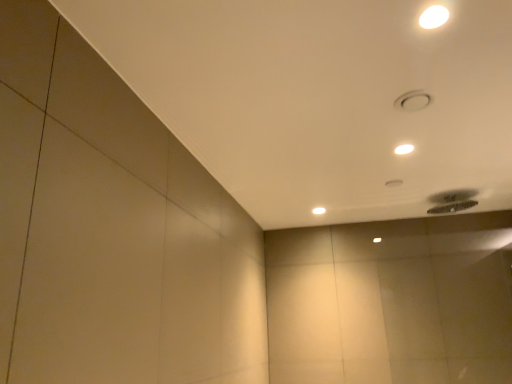
Describe the element at coordinates (404, 149) in the screenshot. I see `white glossy lamp at upper right, the 3th lamp positioned from the left` at that location.

What is the approximate height of white glossy lamp at upper right, the 1th lamp positioned from the front?

The height of white glossy lamp at upper right, the 1th lamp positioned from the front, is 0.39 inches.

The height and width of the screenshot is (384, 512). Describe the element at coordinates (433, 17) in the screenshot. I see `white glossy lamp at upper right, marked as the third lamp in a back-to-front arrangement` at that location.

The width and height of the screenshot is (512, 384). Describe the element at coordinates (319, 210) in the screenshot. I see `white glossy lamp at upper center, which appears as the third lamp when viewed from the top` at that location.

Identify the location of white glossy lamp at upper right, the 3th lamp positioned from the left. (404, 149).

Is white glossy lamp at upper center, the 1th lamp from the bottom, surrounding white glossy lamp at upper right, which is the second lamp in right-to-left order?

That's incorrect, white glossy lamp at upper right, which is the second lamp in right-to-left order, is not inside white glossy lamp at upper center, the 1th lamp from the bottom.

Considering the sizes of objects white glossy lamp at upper center, the 1th lamp from the bottom, and white glossy lamp at upper right, which appears as the 3th lamp when ordered from the bottom, in the image provided, who is smaller, white glossy lamp at upper center, the 1th lamp from the bottom, or white glossy lamp at upper right, which appears as the 3th lamp when ordered from the bottom,?

With smaller size is white glossy lamp at upper right, which appears as the 3th lamp when ordered from the bottom.

Between white glossy lamp at upper center, the third lamp in the front-to-back sequence, and white glossy lamp at upper right, which appears as the 2th lamp when viewed from the left, which one has larger width?

white glossy lamp at upper center, the third lamp in the front-to-back sequence, is wider.

Is white glossy lamp at upper center, the third lamp in the front-to-back sequence, touching white glossy lamp at upper right, placed as the first lamp when sorted from top to bottom?

No, white glossy lamp at upper center, the third lamp in the front-to-back sequence, is not with white glossy lamp at upper right, placed as the first lamp when sorted from top to bottom.

Does white glossy lamp at upper right, the first lamp in the right-to-left sequence, turn towards white glossy lamp at upper center, the 1th lamp from the bottom?

No.

From the image's perspective, between white glossy lamp at upper right, the 3th lamp positioned from the left, and white glossy lamp at upper center, acting as the 1th lamp starting from the back, which one is located above?

white glossy lamp at upper right, the 3th lamp positioned from the left, from the image's perspective.

Considering the sizes of objects white glossy lamp at upper right, which appears as the 2th lamp when viewed from the front, and white glossy lamp at upper center, the 1th lamp from the bottom, in the image provided, who is thinner, white glossy lamp at upper right, which appears as the 2th lamp when viewed from the front, or white glossy lamp at upper center, the 1th lamp from the bottom,?

Thinner between the two is white glossy lamp at upper right, which appears as the 2th lamp when viewed from the front.

Based on the photo, which is correct: white glossy lamp at upper right, which appears as the 2th lamp when viewed from the front, is inside white glossy lamp at upper center, the third lamp positioned from the right, or outside of it?

white glossy lamp at upper right, which appears as the 2th lamp when viewed from the front, is outside white glossy lamp at upper center, the third lamp positioned from the right.

Is white glossy lamp at upper center, the 1th lamp from the bottom, far from white glossy lamp at upper right, the 3th lamp positioned from the left?

They are positioned close to each other.

Can you confirm if white glossy lamp at upper center, the 1th lamp positioned from the left, is shorter than white glossy lamp at upper right, the second lamp from the top?

No.

Is white glossy lamp at upper center, the third lamp in the front-to-back sequence, positioned with its back to white glossy lamp at upper right, which appears as the 2th lamp when ordered from the bottom?

No.

Is white glossy lamp at upper center, the third lamp positioned from the right, at the left side of white glossy lamp at upper right, which appears as the 2th lamp when ordered from the bottom?

Indeed, white glossy lamp at upper center, the third lamp positioned from the right, is positioned on the left side of white glossy lamp at upper right, which appears as the 2th lamp when ordered from the bottom.

Does white glossy lamp at upper right, placed as the first lamp when sorted from top to bottom, have a lesser width compared to white glossy lamp at upper right, which appears as the 2th lamp when viewed from the front?

Indeed, white glossy lamp at upper right, placed as the first lamp when sorted from top to bottom, has a lesser width compared to white glossy lamp at upper right, which appears as the 2th lamp when viewed from the front.

Can you tell me how much white glossy lamp at upper right, which appears as the 3th lamp when ordered from the bottom, and white glossy lamp at upper right, which appears as the 2th lamp when viewed from the front, differ in facing direction?

0.00226 degrees separate the facing orientations of white glossy lamp at upper right, which appears as the 3th lamp when ordered from the bottom, and white glossy lamp at upper right, which appears as the 2th lamp when viewed from the front.

Which is closer, (436, 11) or (398, 148)?

Point (436, 11).

Locate an element on the screen. The height and width of the screenshot is (384, 512). lamp above the white glossy lamp at upper right, which is the 2th lamp in back-to-front order (from a real-world perspective) is located at coordinates pos(433,17).

From the image's perspective, does white glossy lamp at upper right, which appears as the 2th lamp when viewed from the front, appear higher than white glossy lamp at upper right, which is the second lamp in right-to-left order?

No, from the image's perspective, white glossy lamp at upper right, which appears as the 2th lamp when viewed from the front, is not on top of white glossy lamp at upper right, which is the second lamp in right-to-left order.

Can we say white glossy lamp at upper right, which appears as the 2th lamp when viewed from the front, lies outside white glossy lamp at upper right, which appears as the 3th lamp when ordered from the bottom?

Yes, white glossy lamp at upper right, which appears as the 2th lamp when viewed from the front, is located beyond the bounds of white glossy lamp at upper right, which appears as the 3th lamp when ordered from the bottom.

From a real-world perspective, is white glossy lamp at upper right, which appears as the 2th lamp when ordered from the bottom, positioned over white glossy lamp at upper right, which is the second lamp in right-to-left order, based on gravity?

No, from a real-world perspective, white glossy lamp at upper right, which appears as the 2th lamp when ordered from the bottom, is not above white glossy lamp at upper right, which is the second lamp in right-to-left order.

Which object is closer to the camera, white glossy lamp at upper right, which is the second lamp in right-to-left order, or white glossy lamp at upper center, the third lamp positioned from the right?

white glossy lamp at upper right, which is the second lamp in right-to-left order, is closer to the camera.

At what (x,y) coordinates should I click in order to perform the action: click on the 2nd lamp above when counting from the white glossy lamp at upper center, the 1th lamp positioned from the left (from the image's perspective). Please return your answer as a coordinate pair (x, y). This screenshot has height=384, width=512. Looking at the image, I should click on (433, 17).

In terms of height, does white glossy lamp at upper right, which is the second lamp in right-to-left order, look taller or shorter compared to white glossy lamp at upper center, acting as the 1th lamp starting from the back?

In the image, white glossy lamp at upper right, which is the second lamp in right-to-left order, appears to be shorter than white glossy lamp at upper center, acting as the 1th lamp starting from the back.

At what (x,y) coordinates should I click in order to perform the action: click on the 1st lamp to the right of the white glossy lamp at upper center, acting as the 1th lamp starting from the back, starting your count from the anchor. Please return your answer as a coordinate pair (x, y). The height and width of the screenshot is (384, 512). Looking at the image, I should click on (433, 17).

Which lamp is the 1st one when counting from the front of the white glossy lamp at upper center, the 1th lamp from the bottom? Please provide its 2D coordinates.

[(404, 149)]

Which object lies further to the anchor point white glossy lamp at upper center, acting as the 1th lamp starting from the back, white glossy lamp at upper right, which is the 2th lamp in back-to-front order, or white glossy lamp at upper right, placed as the first lamp when sorted from top to bottom?

Among the two, white glossy lamp at upper right, placed as the first lamp when sorted from top to bottom, is located further to white glossy lamp at upper center, acting as the 1th lamp starting from the back.

From the image, which object appears to be nearer to white glossy lamp at upper right, marked as the third lamp in a back-to-front arrangement, white glossy lamp at upper right, which is the 2th lamp in back-to-front order, or white glossy lamp at upper center, acting as the 1th lamp starting from the back?

white glossy lamp at upper right, which is the 2th lamp in back-to-front order, lies closer to white glossy lamp at upper right, marked as the third lamp in a back-to-front arrangement, than the other object.

In the scene shown: Which object lies further to the anchor point white glossy lamp at upper center, the third lamp in the front-to-back sequence, white glossy lamp at upper right, which appears as the 3th lamp when ordered from the bottom, or white glossy lamp at upper right, which appears as the 2th lamp when viewed from the front?

The object further to white glossy lamp at upper center, the third lamp in the front-to-back sequence, is white glossy lamp at upper right, which appears as the 3th lamp when ordered from the bottom.

When comparing their distances from white glossy lamp at upper right, which is the 2th lamp in back-to-front order, does white glossy lamp at upper center, acting as the 1th lamp starting from the back, or white glossy lamp at upper right, the 1th lamp positioned from the front, seem further?

Based on the image, white glossy lamp at upper center, acting as the 1th lamp starting from the back, appears to be further to white glossy lamp at upper right, which is the 2th lamp in back-to-front order.

Which object lies further to the anchor point white glossy lamp at upper right, the second lamp from the top, white glossy lamp at upper right, which appears as the 3th lamp when ordered from the bottom, or white glossy lamp at upper center, the third lamp positioned from the right?

Based on the image, white glossy lamp at upper center, the third lamp positioned from the right, appears to be further to white glossy lamp at upper right, the second lamp from the top.

Looking at the image, which one is located further to white glossy lamp at upper right, placed as the first lamp when sorted from top to bottom, white glossy lamp at upper center, the third lamp positioned from the right, or white glossy lamp at upper right, the second lamp from the top?

white glossy lamp at upper center, the third lamp positioned from the right.

You are a GUI agent. You are given a task and a screenshot of the screen. Output one action in this format:
    pyautogui.click(x=<x>, y=<y>)
    Task: Click on the lamp between white glossy lamp at upper right, which appears as the 3th lamp when ordered from the bottom, and white glossy lamp at upper center, acting as the 1th lamp starting from the back, in the front-back direction
    
    Given the screenshot: What is the action you would take?
    pyautogui.click(x=404, y=149)